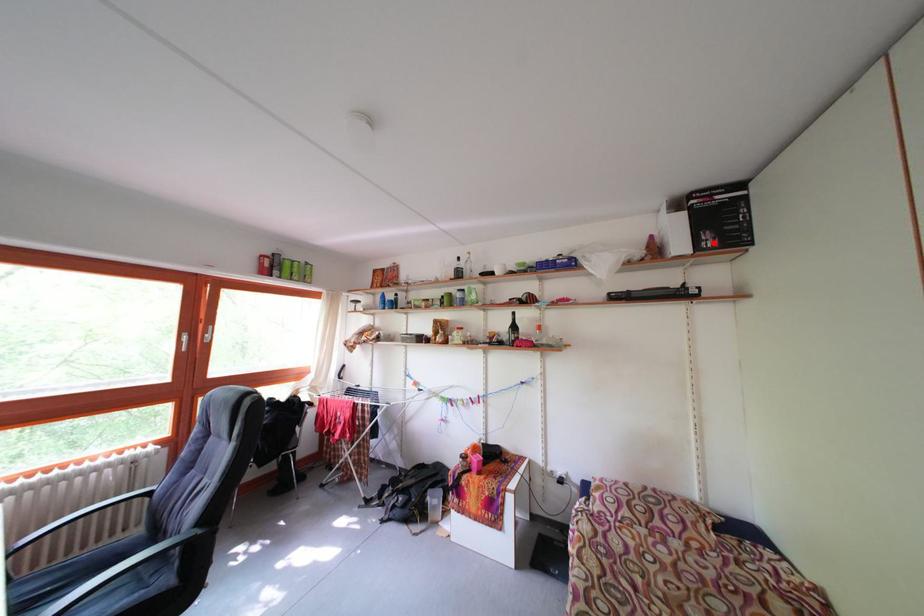
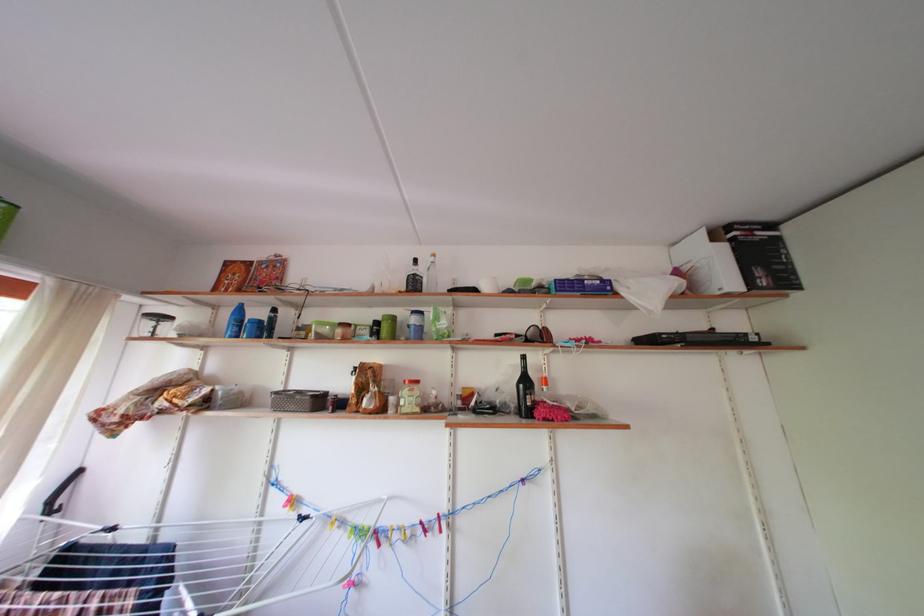
In the second image, find the point that corresponds to the highlighted location in the first image.

(768, 278)